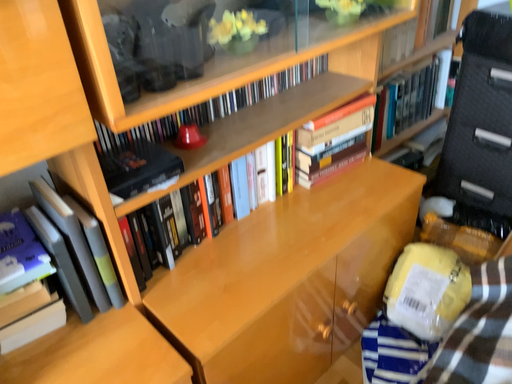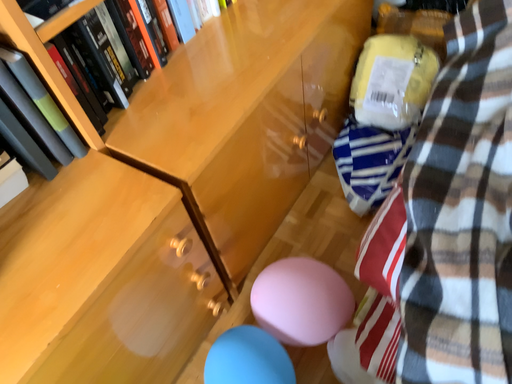
Question: How did the camera likely rotate when shooting the video?

Choices:
 (A) rotated downward
 (B) rotated upward

Answer: (A)